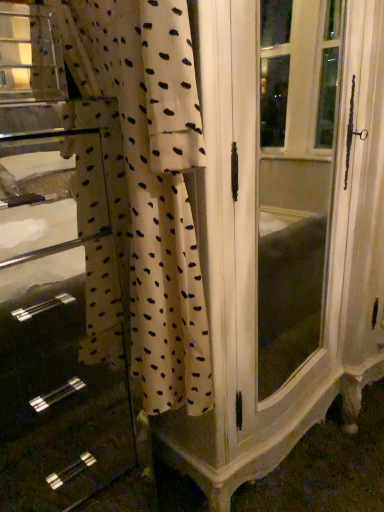
Question: Relative to white dotted fabric at center, is white fabric at left in front or behind?

Choices:
 (A) behind
 (B) front

Answer: (A)

Question: Do you think white fabric at left is within white dotted fabric at center, or outside of it?

Choices:
 (A) outside
 (B) inside

Answer: (A)

Question: In terms of width, does white fabric at left look wider or thinner when compared to white dotted fabric at center?

Choices:
 (A) thin
 (B) wide

Answer: (B)

Question: Is point (152, 147) positioned closer to the camera than point (74, 500)?

Choices:
 (A) farther
 (B) closer

Answer: (B)

Question: In terms of height, does white dotted fabric at center look taller or shorter compared to white fabric at left?

Choices:
 (A) short
 (B) tall

Answer: (A)

Question: Visually, is white dotted fabric at center positioned to the left or to the right of white fabric at left?

Choices:
 (A) left
 (B) right

Answer: (B)

Question: From the image's perspective, is white dotted fabric at center above or below white fabric at left?

Choices:
 (A) below
 (B) above

Answer: (B)